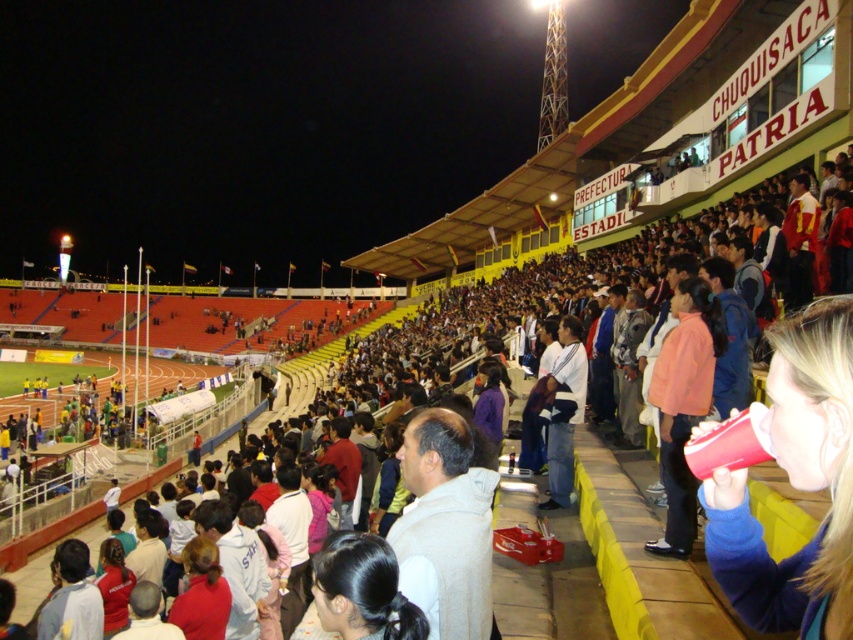
You are a photographer positioned at the center of the stadium, aiming to capture a photo that includes both the matte red cup at lower right and the white cotton shirt at center. Based on their positions, which object should you adjust your camera to focus on first to ensure both are in the frame?

The matte red cup at lower right is to the right of the white cotton shirt at center, so you should focus on the white cotton shirt at center first to ensure the matte red cup at lower right is within the frame to its right.

You are standing at the center of the stadium field. You see a point marked at coordinates (795, 483). What object is located at that point?

The point at coordinates (795, 483) corresponds to the matte red cup at lower right.

You are standing at the point with coordinates point (769, 340) and want to move to the point with coordinates point (556, 433). Given that the stadium has multiple tiers of seating, which direction should you move to reach your destination?

Since point (769, 340) is in front of point (556, 433), you should move backward to reach your destination.